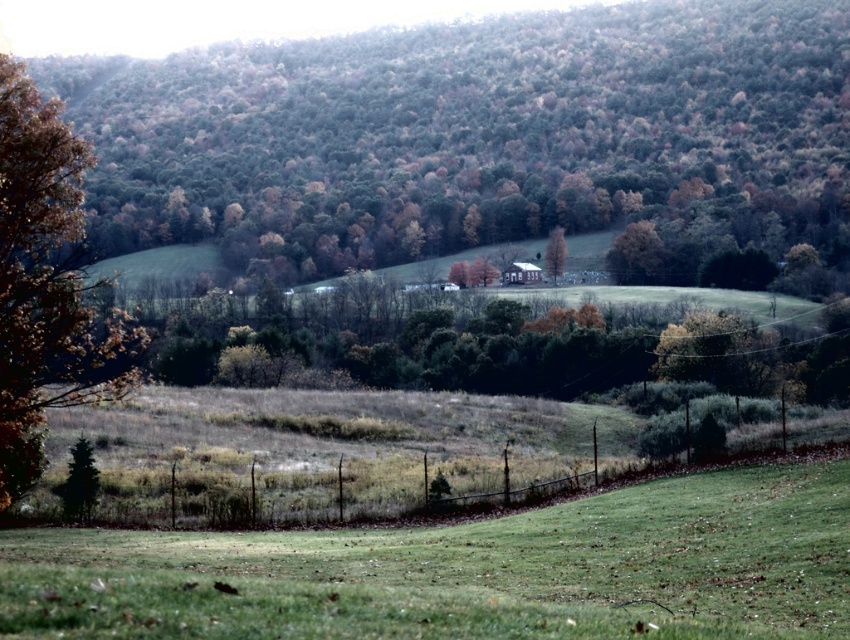
Question: Considering the real-world distances, which object is farthest from the brown textured tree at left?

Choices:
 (A) green grassy field at lower center
 (B) brown matte tree at center
 (C) brown leafy tree at center

Answer: (C)

Question: Observing the image, what is the correct spatial positioning of brown leafy tree at center in reference to green grassy field at lower center?

Choices:
 (A) below
 (B) above

Answer: (B)

Question: Based on their relative distances, which object is nearer to the brown leafy tree at center?

Choices:
 (A) green grassy field at lower center
 (B) brown textured tree at left
 (C) brown matte tree at center

Answer: (C)

Question: In this image, where is green grassy field at lower center located relative to brown matte tree at center?

Choices:
 (A) below
 (B) above

Answer: (A)

Question: Which object is the closest to the green grassy field at lower center?

Choices:
 (A) brown leafy tree at center
 (B) brown matte tree at center
 (C) brown textured tree at left

Answer: (C)

Question: Observing the image, what is the correct spatial positioning of brown textured tree at left in reference to brown matte tree at center?

Choices:
 (A) above
 (B) below

Answer: (B)